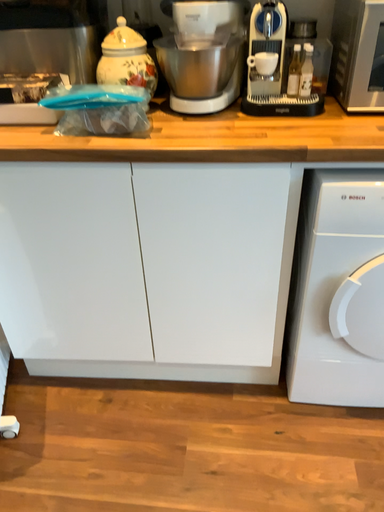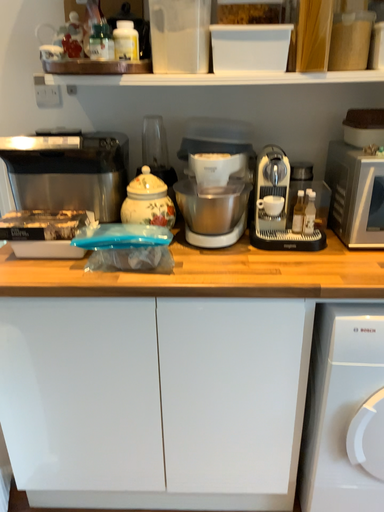
Question: Which way did the camera rotate in the video?

Choices:
 (A) rotated downward
 (B) rotated upward

Answer: (B)